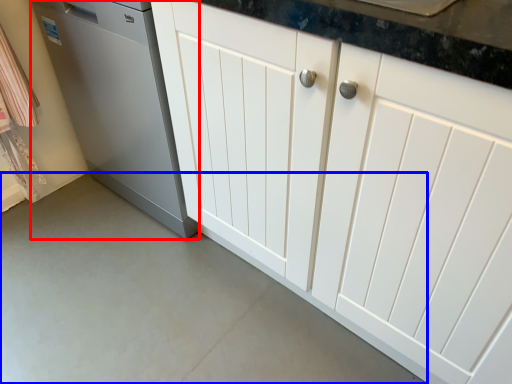
Question: Which of the following is the closest to the observer, home appliance (highlighted by a red box) or concrete (highlighted by a blue box)?

Choices:
 (A) home appliance
 (B) concrete

Answer: (B)